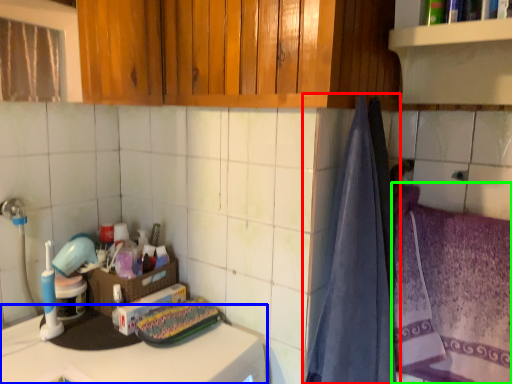
Question: Which object is positioned closest to curtain (highlighted by a red box)? Select from counter top (highlighted by a blue box) and beach towel (highlighted by a green box).

Choices:
 (A) counter top
 (B) beach towel

Answer: (B)